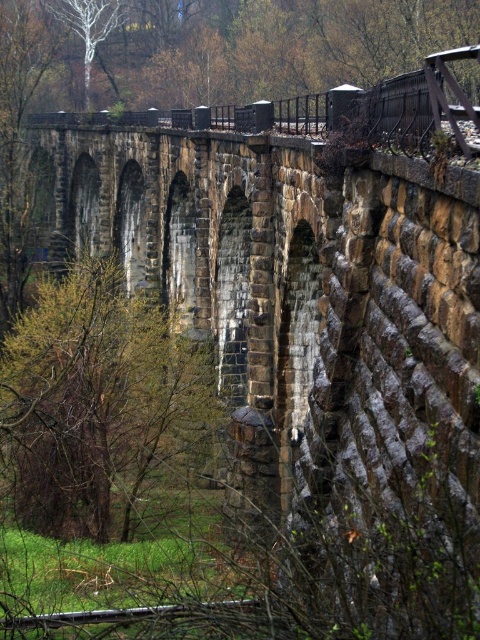
You are a photographer planning to capture the historic stone viaduct. You notice the smooth metal train track at lower center and the white smooth tree at upper left in your viewfinder. Which object appears larger in the photo?

The white smooth tree at upper left appears larger in the photo because the smooth metal train track at lower center is smaller than it.

You are standing on the historic stone viaduct and want to walk towards the green leafy tree at center and the smooth metal train track at lower center. Which object will you reach first?

You will reach the green leafy tree at center first because it is closer to you than the smooth metal train track at lower center.

You are standing at the base of the historic stone viaduct and want to take a photo. You notice two points on the viaduct marked as point 1 at coordinates (x=148, y=420) and point 2 at coordinates (x=222, y=604). Which point will appear closer to the camera in your photo?

Point 2 at coordinates (x=222, y=604) will appear closer to the camera in the photo because it is closer to the viewer than point 1 at coordinates (x=148, y=420).